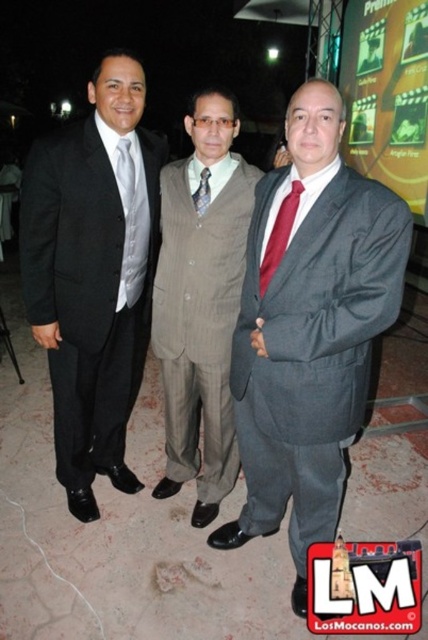
Question: Can you confirm if matte gray suit at center is wider than gray pinstripe suit at center?

Choices:
 (A) no
 (B) yes

Answer: (B)

Question: Which of the following is the closest to the observer?

Choices:
 (A) matte gray suit at center
 (B) matte black suit at left
 (C) matte white tie at center
 (D) gray pinstripe suit at center

Answer: (A)

Question: Which point is closer to the camera?

Choices:
 (A) gray pinstripe suit at center
 (B) patterned silk tie at center
 (C) matte red tie at center
 (D) matte gray suit at center

Answer: (D)

Question: Is matte gray suit at center bigger than gray pinstripe suit at center?

Choices:
 (A) no
 (B) yes

Answer: (A)

Question: Which object appears farthest from the camera in this image?

Choices:
 (A) matte black suit at left
 (B) matte red tie at center
 (C) gray pinstripe suit at center

Answer: (C)

Question: Where is matte gray suit at center located in relation to matte red tie at center in the image?

Choices:
 (A) left
 (B) right

Answer: (B)